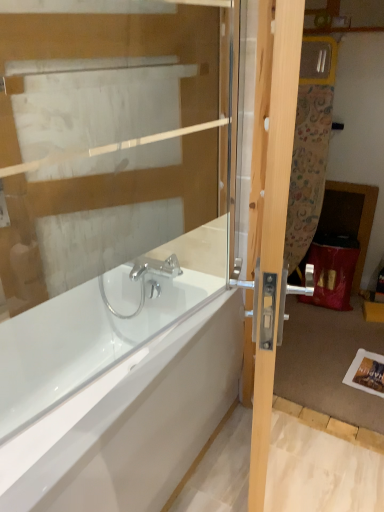
Question: Considering the relative sizes of light wood door at right and white glossy bathtub at center in the image provided, is light wood door at right shorter than white glossy bathtub at center?

Choices:
 (A) yes
 (B) no

Answer: (B)

Question: Considering the relative sizes of light wood door at right and white glossy bathtub at center in the image provided, is light wood door at right wider than white glossy bathtub at center?

Choices:
 (A) yes
 (B) no

Answer: (B)

Question: Is light wood door at right smaller than white glossy bathtub at center?

Choices:
 (A) no
 (B) yes

Answer: (B)

Question: Is light wood door at right to the right of white glossy bathtub at center from the viewer's perspective?

Choices:
 (A) no
 (B) yes

Answer: (B)

Question: Considering the relative sizes of light wood door at right and white glossy bathtub at center in the image provided, is light wood door at right thinner than white glossy bathtub at center?

Choices:
 (A) no
 (B) yes

Answer: (B)

Question: Does point (18, 451) appear closer or farther from the camera than point (269, 358)?

Choices:
 (A) farther
 (B) closer

Answer: (A)

Question: Considering the positions of white glossy bathtub at center and light wood door at right in the image, is white glossy bathtub at center taller or shorter than light wood door at right?

Choices:
 (A) tall
 (B) short

Answer: (B)

Question: Is white glossy bathtub at center wider or thinner than light wood door at right?

Choices:
 (A) wide
 (B) thin

Answer: (A)

Question: From the image's perspective, relative to light wood door at right, is white glossy bathtub at center above or below?

Choices:
 (A) below
 (B) above

Answer: (A)

Question: Choose the correct answer: Is light wood door at right inside transparent glass door at upper center or outside it?

Choices:
 (A) inside
 (B) outside

Answer: (B)

Question: Is light wood door at right bigger or smaller than transparent glass door at upper center?

Choices:
 (A) big
 (B) small

Answer: (A)

Question: Looking at their shapes, would you say light wood door at right is wider or thinner than transparent glass door at upper center?

Choices:
 (A) thin
 (B) wide

Answer: (B)

Question: Relative to transparent glass door at upper center, is light wood door at right in front or behind?

Choices:
 (A) front
 (B) behind

Answer: (A)

Question: Is white glossy bathtub at center bigger or smaller than transparent glass door at upper center?

Choices:
 (A) small
 (B) big

Answer: (B)

Question: From their relative heights in the image, would you say white glossy bathtub at center is taller or shorter than transparent glass door at upper center?

Choices:
 (A) short
 (B) tall

Answer: (A)